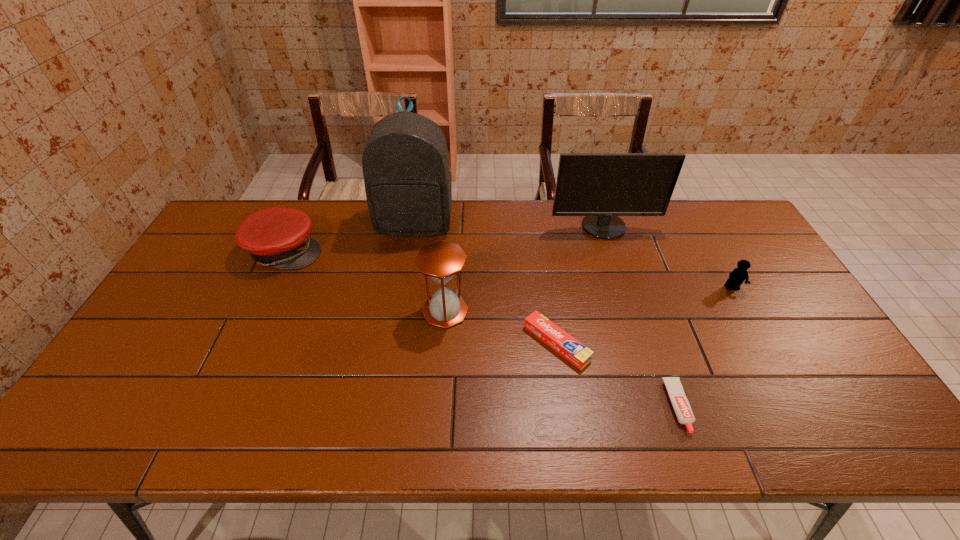
The height and width of the screenshot is (540, 960). What are the coordinates of `free space that satisfies the following two spatial constraints: 1. on the front of the cap with an emblem; 2. on the right side of the third tallest object` in the screenshot? It's located at (256, 311).

Identify the location of free point that satisfies the following two spatial constraints: 1. on the front of the shorter toothpaste with an emblem; 2. on the right side of the cap. Image resolution: width=960 pixels, height=540 pixels. (212, 407).

Find the location of a particular element. The image size is (960, 540). blank area in the image that satisfies the following two spatial constraints: 1. on the front of the leftmost object with an emblem; 2. on the back side of the shortest object is located at coordinates (212, 407).

You are a GUI agent. You are given a task and a screenshot of the screen. Output one action in this format:
    pyautogui.click(x=<x>, y=<y>)
    Task: Click on the blank area in the image that satisfies the following two spatial constraints: 1. on the front-facing side of the tallest object; 2. on the right side of the third tallest object
    The width and height of the screenshot is (960, 540).
    Given the screenshot: What is the action you would take?
    pyautogui.click(x=400, y=311)

Find the location of `free region that satisfies the following two spatial constraints: 1. on the back side of the farther toothpaste; 2. on the front of the cap with an emblem`. free region that satisfies the following two spatial constraints: 1. on the back side of the farther toothpaste; 2. on the front of the cap with an emblem is located at coordinates (542, 251).

Where is `free spot that satisfies the following two spatial constraints: 1. on the front-facing side of the shortest object; 2. on the right side of the backpack`? The image size is (960, 540). free spot that satisfies the following two spatial constraints: 1. on the front-facing side of the shortest object; 2. on the right side of the backpack is located at coordinates (385, 407).